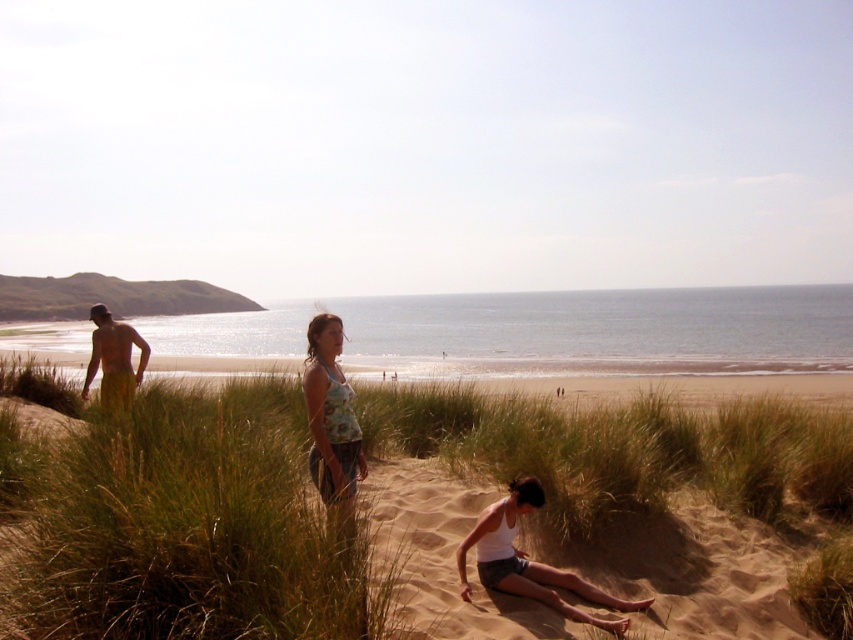
Which of these two, sandy tan sand at lower center or beige sand at center, stands taller?

Standing taller between the two is beige sand at center.

Does sandy tan sand at lower center have a smaller size compared to beige sand at center?

Correct, sandy tan sand at lower center occupies less space than beige sand at center.

The image size is (853, 640). What are the coordinates of `sandy tan sand at lower center` in the screenshot? It's located at (693, 572).

Can you confirm if beige sand at center is positioned below yellow shorts at left?

Correct, beige sand at center is located below yellow shorts at left.

What do you see at coordinates (628, 381) in the screenshot? The height and width of the screenshot is (640, 853). I see `beige sand at center` at bounding box center [628, 381].

Image resolution: width=853 pixels, height=640 pixels. Find the location of `beige sand at center`. beige sand at center is located at coordinates (628, 381).

Does point (500, 554) lie in front of point (112, 349)?

Yes.

Does white cotton tank top at lower center have a smaller size compared to yellow shorts at left?

Indeed, white cotton tank top at lower center has a smaller size compared to yellow shorts at left.

Is point (509, 518) less distant than point (94, 360)?

Yes.

You are a GUI agent. You are given a task and a screenshot of the screen. Output one action in this format:
    pyautogui.click(x=<x>, y=<y>)
    Task: Click on the white cotton tank top at lower center
    The height and width of the screenshot is (640, 853).
    Given the screenshot: What is the action you would take?
    [x=529, y=561]